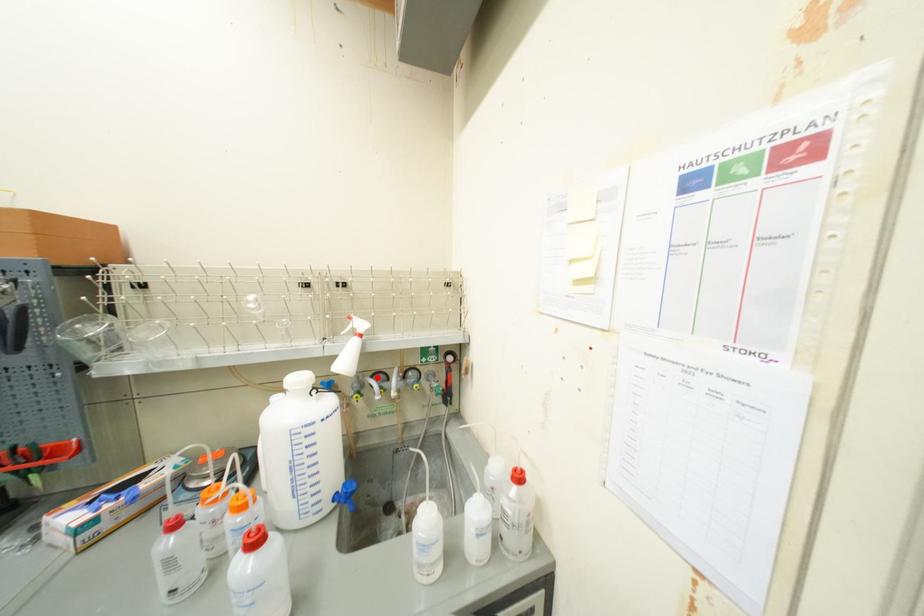
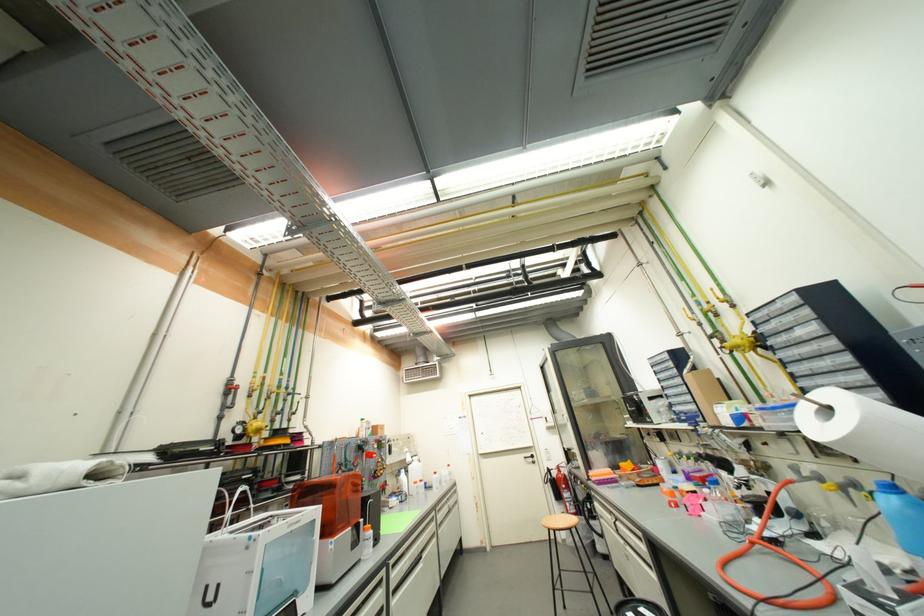
Question: I am providing you with two images of the same scene from different viewpoints. A red point is marked on the first image. At the location where the point appears in image 1, is it still visible in image 2?

Choices:
 (A) Yes
 (B) No

Answer: (B)